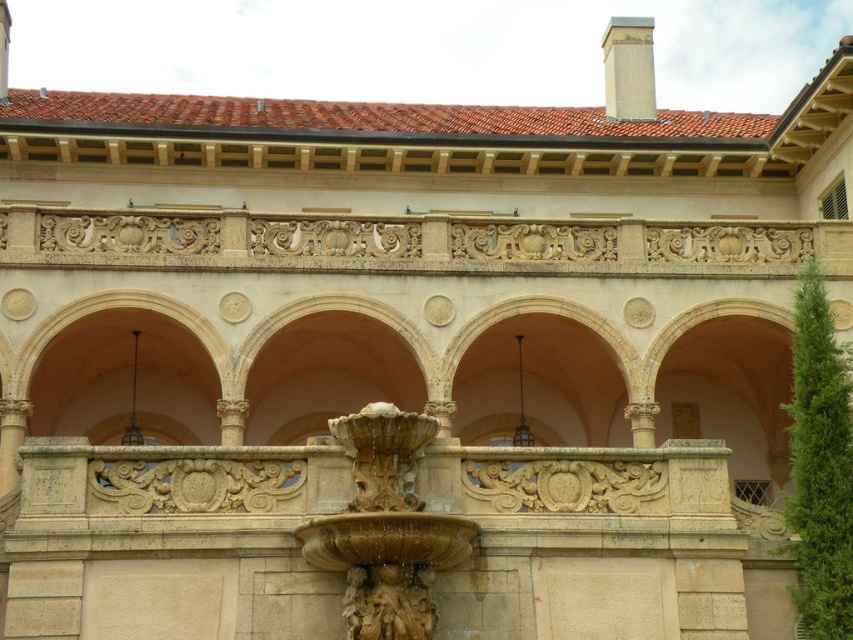
Question: Observing the image, what is the correct spatial positioning of carved stone fountain at center in reference to smooth beige chimney at upper center?

Choices:
 (A) left
 (B) right

Answer: (A)

Question: Can you confirm if carved stone fountain at center is smaller than smooth beige chimney at upper center?

Choices:
 (A) yes
 (B) no

Answer: (A)

Question: Which of the following is the farthest from the observer?

Choices:
 (A) (396, 576)
 (B) (646, 113)

Answer: (B)

Question: Which of the following is the closest to the observer?

Choices:
 (A) smooth beige chimney at upper center
 (B) carved stone fountain at center

Answer: (B)

Question: Does carved stone fountain at center appear under smooth beige chimney at upper center?

Choices:
 (A) no
 (B) yes

Answer: (B)